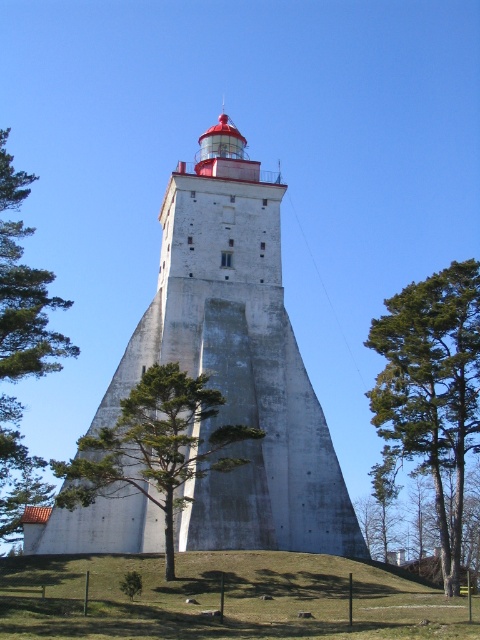
You are an architect evaluating the lighthouse design. You need to determine if the white concrete tower at center can be painted with a special coating that requires a minimum of 3 meters width. Given that the green textured tree at center is 2 meters wide, can the tower accommodate the coating?

The white concrete tower at center is wider than the green textured tree at center, which is 2 meters wide. Therefore, the tower is at least 3 meters wide and can accommodate the special coating.

You are standing at the base of the lighthouse and notice two trees in the scene. Which tree, the green pine tree at center or the green leafy tree at left, is positioned closer to the ground?

The green pine tree at center is positioned closer to the ground because it is below the green leafy tree at left.

You are a bird looking for a place to perch. You see a green pine tree at center and a green textured tree at center. Which tree would you choose if you prefer a taller tree to rest on?

The green pine tree at center is taller than the green textured tree at center, so you should choose the green pine tree at center for perching.